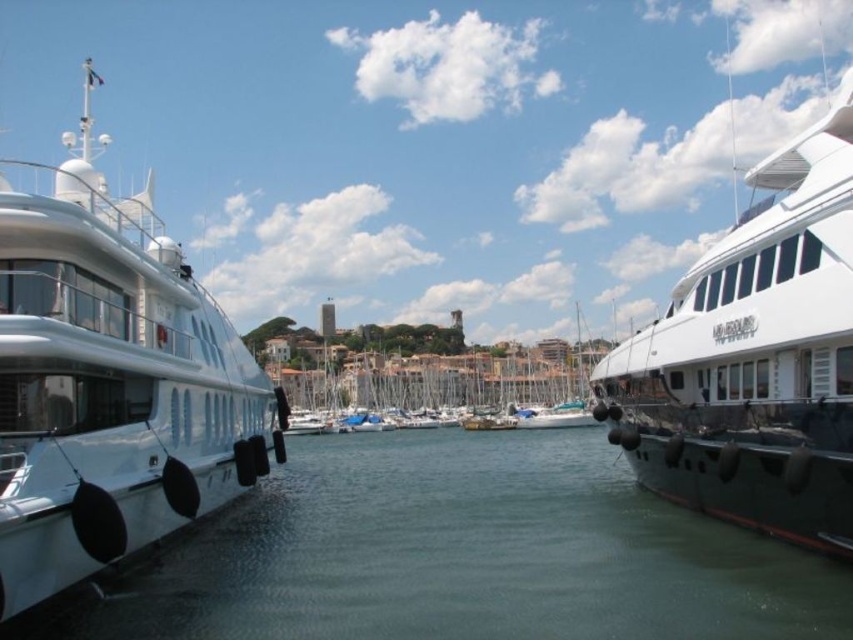
You are a photographer standing on the dock and want to capture a photo of the clear water at center and the white glossy yacht at left. Which object will appear closer to the camera in the photo?

The clear water at center appears closer to the camera than the white glossy yacht at left because it is further to the viewer.

You are a photographer planning to capture the marina scene. You want to ensure that both the clear water at center and the white glossy yacht at left are visible in your shot. Given their sizes, which object should you focus on to include both in the frame?

The clear water at center is smaller than the white glossy yacht at left, so focusing on the white glossy yacht at left would allow the smaller clear water at center to fit within the frame more easily.

You are standing on the deck of the yacht on the left. You want to throw a small floating toy into the clear water at center. In which direction should you throw it relative to the yacht on the left?

The clear water at center is located at point (461, 554), so you should throw the toy towards the right side of the yacht on the left to reach the clear water at center.